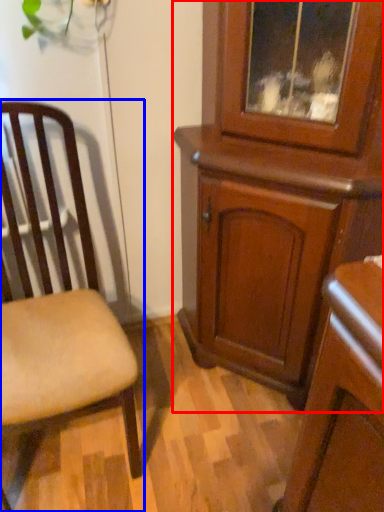
Question: Which object appears closest to the camera in this image, cabinetry (highlighted by a red box) or chair (highlighted by a blue box)?

Choices:
 (A) cabinetry
 (B) chair

Answer: (B)